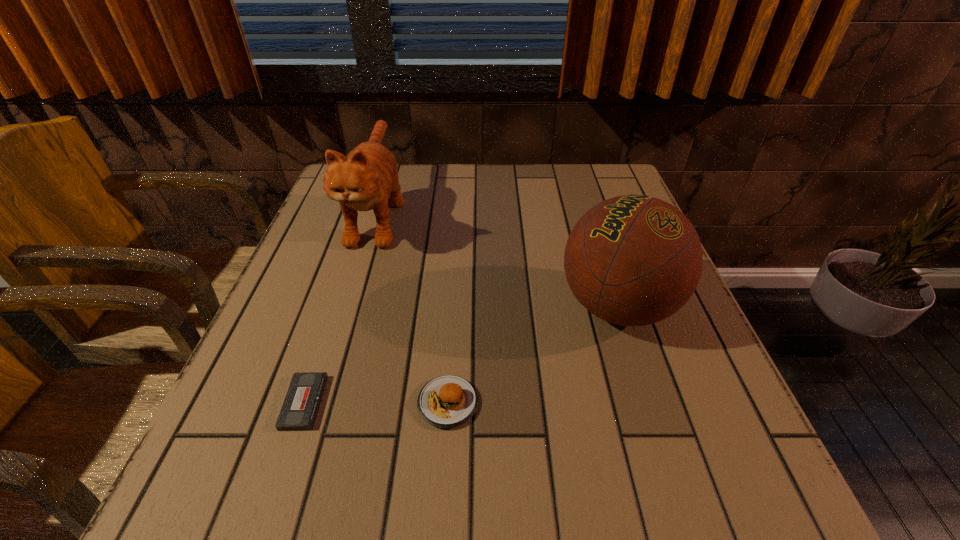
Select which object appears as the second closest to the second farthest object. Please provide its 2D coordinates. Your answer should be formatted as a tuple, i.e. [(x, y)], where the tuple contains the x and y coordinates of a point satisfying the conditions above.

[(362, 181)]

Identify which object is located as the nearest to the cat. Please provide its 2D coordinates. Your answer should be formatted as a tuple, i.e. [(x, y)], where the tuple contains the x and y coordinates of a point satisfying the conditions above.

[(300, 408)]

Locate an element on the screen. vacant space that satisfies the following two spatial constraints: 1. on the face of the cat; 2. on the right side of the third tallest object is located at coordinates (320, 403).

This screenshot has width=960, height=540. Find the location of `blank area in the image that satisfies the following two spatial constraints: 1. on the face of the farthest object; 2. on the right side of the second shortest object`. blank area in the image that satisfies the following two spatial constraints: 1. on the face of the farthest object; 2. on the right side of the second shortest object is located at coordinates point(320,403).

You are a GUI agent. You are given a task and a screenshot of the screen. Output one action in this format:
    pyautogui.click(x=<x>, y=<y>)
    Task: Click on the vacant area that satisfies the following two spatial constraints: 1. on the face of the food; 2. on the right side of the farthest object
    
    Given the screenshot: What is the action you would take?
    pyautogui.click(x=320, y=403)